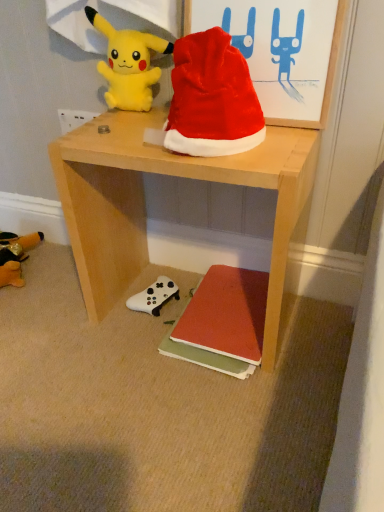
The height and width of the screenshot is (512, 384). I want to click on free space in front of yellow plush at upper left, so click(x=122, y=126).